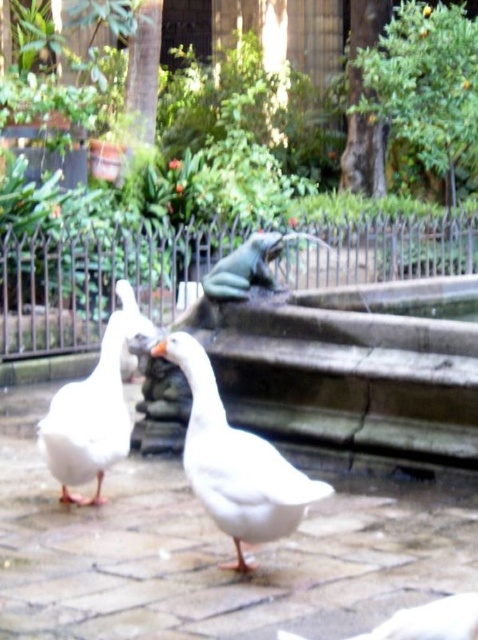
You are a photographer standing in the courtyard and want to take a photo of the two points marked in the image. Which point, point (x=391, y=620) or point (x=163, y=353), will appear larger in your photo?

Point (x=391, y=620) will appear larger in the photo because it is closer to the camera than point (x=163, y=353).